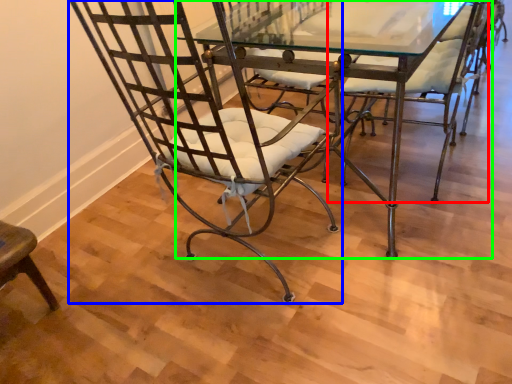
Question: Which is nearer to the chair (highlighted by a red box)? chair (highlighted by a blue box) or table (highlighted by a green box).

Choices:
 (A) chair
 (B) table

Answer: (B)